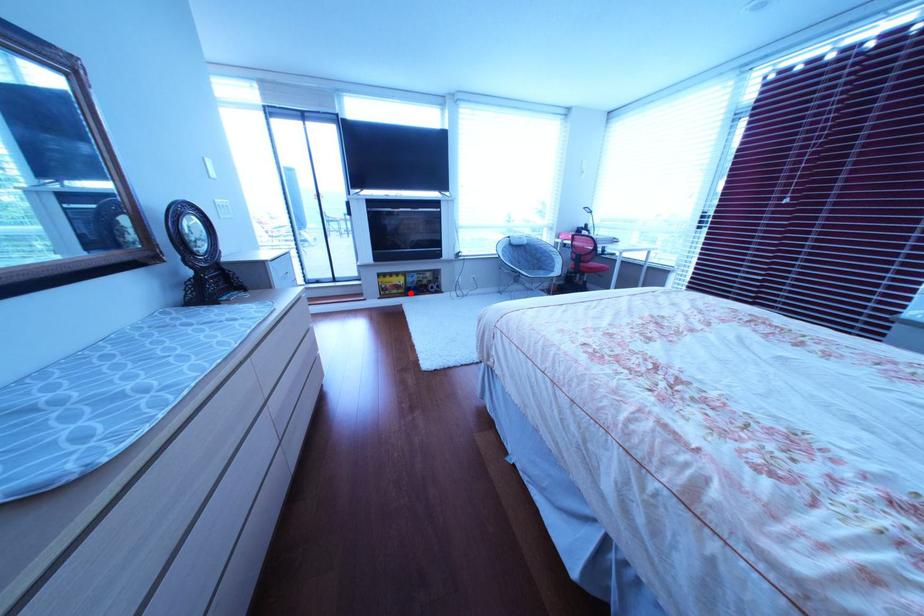
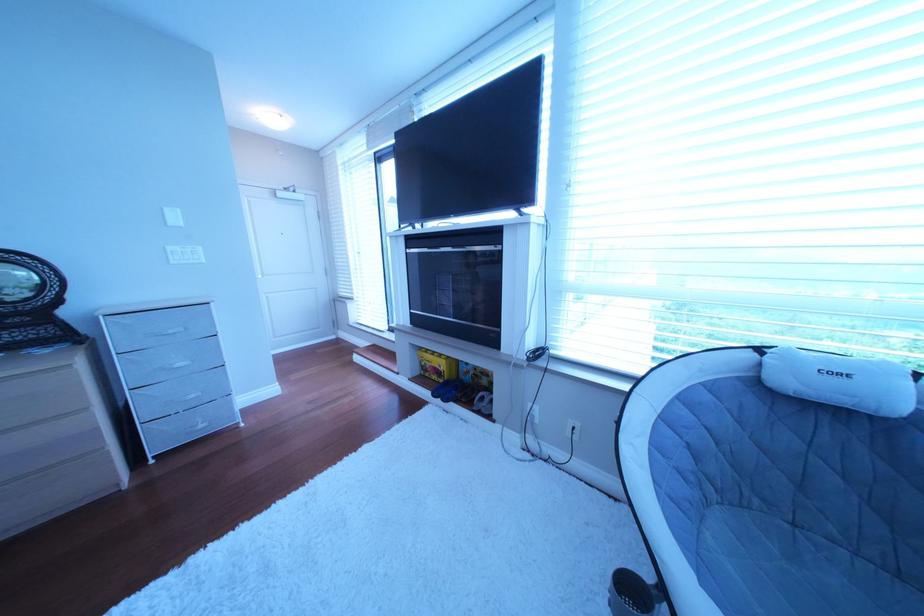
Question: I am providing you with two images of the same scene from different viewpoints. In image1, a red point is highlighted. Considering the same 3D point in image2, which of the following is correct?

Choices:
 (A) It is closer
 (B) It is farther

Answer: (B)